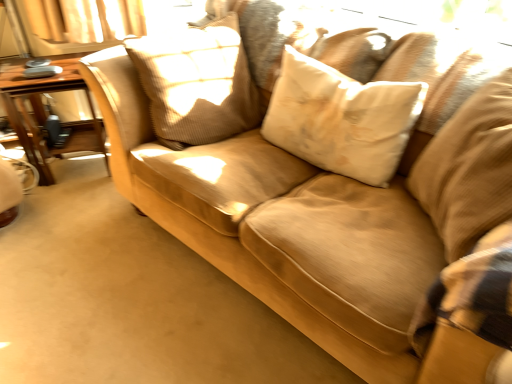
Question: Is wooden table at left not near white soft pillow at center, arranged as the 2th pillow when viewed from the right?

Choices:
 (A) yes
 (B) no

Answer: (A)

Question: Can you see wooden table at left touching white soft pillow at center, arranged as the 2th pillow when viewed from the right?

Choices:
 (A) no
 (B) yes

Answer: (A)

Question: From the image's perspective, would you say wooden table at left is positioned over white soft pillow at center, arranged as the 2th pillow when viewed from the right?

Choices:
 (A) no
 (B) yes

Answer: (B)

Question: Can white soft pillow at center, arranged as the 2th pillow when viewed from the left, be found inside wooden table at left?

Choices:
 (A) no
 (B) yes

Answer: (A)

Question: Is wooden table at left outside of white soft pillow at center, arranged as the 2th pillow when viewed from the left?

Choices:
 (A) yes
 (B) no

Answer: (A)

Question: Considering the relative sizes of wooden table at left and white soft pillow at center, arranged as the 2th pillow when viewed from the right, in the image provided, is wooden table at left wider than white soft pillow at center, arranged as the 2th pillow when viewed from the right,?

Choices:
 (A) no
 (B) yes

Answer: (B)

Question: From a real-world perspective, is beige textured pillow at center, the 1th pillow from the left, positioned under beige fabric pillow at right, which is counted as the first pillow, starting from the right, based on gravity?

Choices:
 (A) yes
 (B) no

Answer: (A)

Question: Can you confirm if beige textured pillow at center, the third pillow from the right, is bigger than beige fabric pillow at right, which appears as the third pillow when viewed from the left?

Choices:
 (A) yes
 (B) no

Answer: (B)

Question: Could beige fabric pillow at right, which appears as the third pillow when viewed from the left, be considered to be inside beige textured pillow at center, the 1th pillow from the left?

Choices:
 (A) yes
 (B) no

Answer: (B)

Question: From a real-world perspective, is beige textured pillow at center, the 1th pillow from the left, on top of beige fabric pillow at right, which appears as the third pillow when viewed from the left?

Choices:
 (A) yes
 (B) no

Answer: (B)

Question: Considering the relative positions of beige textured pillow at center, the 1th pillow from the left, and beige fabric pillow at right, which appears as the third pillow when viewed from the left, in the image provided, is beige textured pillow at center, the 1th pillow from the left, to the left of beige fabric pillow at right, which appears as the third pillow when viewed from the left, from the viewer's perspective?

Choices:
 (A) no
 (B) yes

Answer: (B)

Question: Does beige textured pillow at center, the 1th pillow from the left, have a greater height compared to beige fabric pillow at right, which is counted as the first pillow, starting from the right?

Choices:
 (A) yes
 (B) no

Answer: (B)

Question: From a real-world perspective, is beige fabric pillow at right, which is counted as the first pillow, starting from the right, positioned under wooden table at left based on gravity?

Choices:
 (A) yes
 (B) no

Answer: (B)